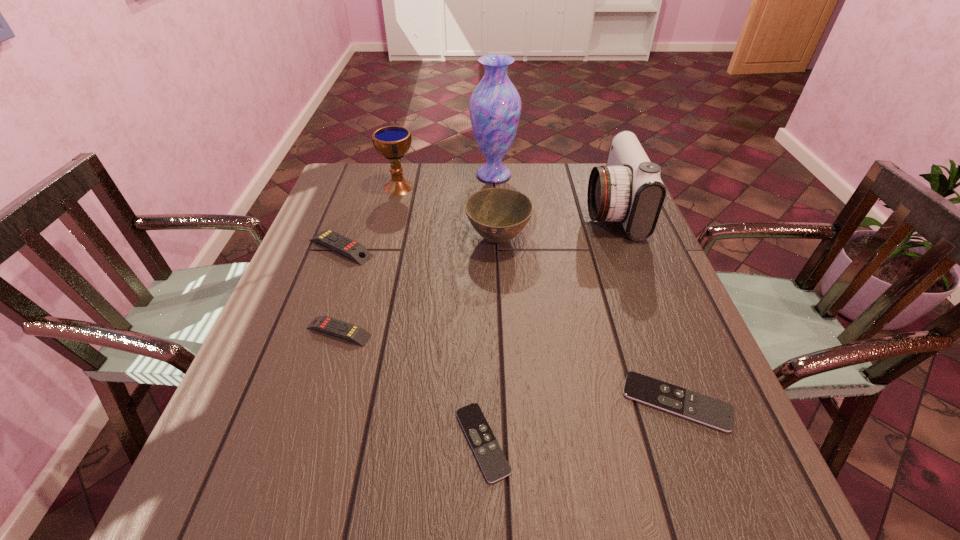
In order to click on free spot that satisfies the following two spatial constraints: 1. on the surface of the camcorder; 2. on the front side of the bowl in this screenshot , I will do `click(622, 239)`.